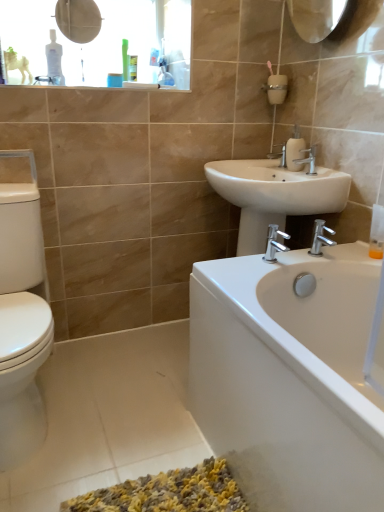
Consider the image. What is the approximate height of translucent plastic soap dispenser at right?

translucent plastic soap dispenser at right is 6.86 inches in height.

Locate an element on the screen. The height and width of the screenshot is (512, 384). matte plastic medicine cabinet at upper left is located at coordinates (96, 42).

Measure the distance between point (359, 488) and camera.

A distance of 28.58 inches exists between point (359, 488) and camera.

What is the approximate width of silver metallic faucet at lower right, the 2th tap viewed from the top?

silver metallic faucet at lower right, the 2th tap viewed from the top, is 4.57 inches wide.

Locate an element on the screen. The height and width of the screenshot is (512, 384). white glossy soap dispenser at upper right is located at coordinates (295, 150).

You are a GUI agent. You are given a task and a screenshot of the screen. Output one action in this format:
    pyautogui.click(x=<x>, y=<y>)
    Task: Click on the translucent plastic soap dispenser at right
    
    Given the screenshot: What is the action you would take?
    pyautogui.click(x=377, y=233)

How distant is white ceramic sink at center from translucent plastic soap dispenser at right?

The distance of white ceramic sink at center from translucent plastic soap dispenser at right is 14.11 inches.

Looking at their sizes, would you say white ceramic sink at center is wider or thinner than translucent plastic soap dispenser at right?

Considering their sizes, white ceramic sink at center looks broader than translucent plastic soap dispenser at right.

Is white ceramic sink at center next to translucent plastic soap dispenser at right?

No, white ceramic sink at center is not touching translucent plastic soap dispenser at right.

Is white ceramic sink at center completely or partially outside of translucent plastic soap dispenser at right?

white ceramic sink at center is positioned outside translucent plastic soap dispenser at right.

Does point (383, 240) lie in front of point (243, 236)?

Yes, it is.

Which of these two, translucent plastic soap dispenser at right or white ceramic sink at center, is thinner?

With smaller width is translucent plastic soap dispenser at right.

From the image's perspective, does translucent plastic soap dispenser at right appear lower than white ceramic sink at center?

Yes, from the image's perspective, translucent plastic soap dispenser at right is beneath white ceramic sink at center.

Is translucent plastic soap dispenser at right bigger or smaller than white ceramic sink at center?

Clearly, translucent plastic soap dispenser at right is smaller in size than white ceramic sink at center.

Is silver metallic faucet at upper center, the second tap when ordered from bottom to top, smaller than white glossy bathtub at lower right?

Indeed, silver metallic faucet at upper center, the second tap when ordered from bottom to top, has a smaller size compared to white glossy bathtub at lower right.

Relative to white glossy bathtub at lower right, is silver metallic faucet at upper center, marked as the 2th tap in a front-to-back arrangement, in front or behind?

Clearly, silver metallic faucet at upper center, marked as the 2th tap in a front-to-back arrangement, is behind white glossy bathtub at lower right.

From a real-world perspective, which is physically above, silver metallic faucet at upper center, the 1th tap from the back, or white glossy bathtub at lower right?

In real-world perspective, silver metallic faucet at upper center, the 1th tap from the back, is above.

Consider the image. Considering the sizes of silver metallic faucet at upper center, marked as the 2th tap in a front-to-back arrangement, and white glossy bathtub at lower right in the image, is silver metallic faucet at upper center, marked as the 2th tap in a front-to-back arrangement, taller or shorter than white glossy bathtub at lower right?

In the image, silver metallic faucet at upper center, marked as the 2th tap in a front-to-back arrangement, appears to be shorter than white glossy bathtub at lower right.

Does white glossy bathtub at lower right turn towards silver metallic faucet at upper center, marked as the 2th tap in a front-to-back arrangement?

No, white glossy bathtub at lower right does not turn towards silver metallic faucet at upper center, marked as the 2th tap in a front-to-back arrangement.

From a real-world perspective, is white glossy bathtub at lower right physically below silver metallic faucet at upper center, marked as the 2th tap in a front-to-back arrangement?

Correct, in the physical world, white glossy bathtub at lower right is lower than silver metallic faucet at upper center, marked as the 2th tap in a front-to-back arrangement.

Considering the sizes of objects white glossy bathtub at lower right and silver metallic faucet at upper center, marked as the 2th tap in a front-to-back arrangement, in the image provided, who is wider, white glossy bathtub at lower right or silver metallic faucet at upper center, marked as the 2th tap in a front-to-back arrangement,?

With larger width is white glossy bathtub at lower right.

Can you tell me how much white glossy bathtub at lower right and silver metallic faucet at upper center, the second tap when ordered from bottom to top, differ in facing direction?

The angle between the facing direction of white glossy bathtub at lower right and the facing direction of silver metallic faucet at upper center, the second tap when ordered from bottom to top, is 0.626 degrees.

Is silver metallic faucet at lower right, the first tap when ordered from front to back, turned away from white glossy bathtub at lower right?

No.

Considering the positions of objects silver metallic faucet at lower right, the first tap when ordered from front to back, and white glossy bathtub at lower right in the image provided, who is behind, silver metallic faucet at lower right, the first tap when ordered from front to back, or white glossy bathtub at lower right?

silver metallic faucet at lower right, the first tap when ordered from front to back, is more distant.

Is white glossy bathtub at lower right inside silver metallic faucet at lower right, the first tap when ordered from front to back?

No.

Is silver metallic faucet at lower right, the first tap when ordered from front to back, thinner than white glossy bathtub at lower right?

Yes.

Would you consider translucent plastic soap dispenser at right to be distant from white glossy bathtub at lower right?

Actually, translucent plastic soap dispenser at right and white glossy bathtub at lower right are a little close together.

Between translucent plastic soap dispenser at right and white glossy bathtub at lower right, which one has smaller width?

With smaller width is translucent plastic soap dispenser at right.

There is a white glossy bathtub at lower right. Where is `toiletry above it (from a real-world perspective)`? The image size is (384, 512). toiletry above it (from a real-world perspective) is located at coordinates (377, 233).

From the picture: Which object is closer to the camera, translucent plastic soap dispenser at right or white glossy bathtub at lower right?

Positioned in front is white glossy bathtub at lower right.

Based on their sizes in the image, would you say matte plastic medicine cabinet at upper left is bigger or smaller than white glossy bathtub at lower right?

Considering their sizes, matte plastic medicine cabinet at upper left takes up less space than white glossy bathtub at lower right.

What's the angular difference between matte plastic medicine cabinet at upper left and white glossy bathtub at lower right's facing directions?

matte plastic medicine cabinet at upper left and white glossy bathtub at lower right are facing 89.5 degrees away from each other.

Is matte plastic medicine cabinet at upper left behind white glossy bathtub at lower right?

Yes, it is.

Is point (49, 65) less distant than point (273, 438)?

No, it is behind (273, 438).

Locate an element on the screen. Image resolution: width=384 pixels, height=512 pixels. sink that is above the translucent plastic soap dispenser at right (from a real-world perspective) is located at coordinates (274, 195).

You are a GUI agent. You are given a task and a screenshot of the screen. Output one action in this format:
    pyautogui.click(x=<x>, y=<y>)
    Task: Click on the sink above the translucent plastic soap dispenser at right (from the image's perspective)
    
    Given the screenshot: What is the action you would take?
    pyautogui.click(x=274, y=195)

When comparing their distances from translucent plastic soap dispenser at right, does white glossy bathtub at lower right or white glossy soap dispenser at upper right seem further?

Among the two, white glossy bathtub at lower right is located further to translucent plastic soap dispenser at right.

From the image, which object appears to be farther from white ceramic sink at center, silver metallic faucet at lower right, the first tap when ordered from front to back, or silver metallic faucet at upper center, marked as the 2th tap in a front-to-back arrangement?

silver metallic faucet at lower right, the first tap when ordered from front to back, is further to white ceramic sink at center.

Estimate the real-world distances between objects in this image. Which object is closer to silver metallic faucet at lower right, the first tap when ordered from front to back, silver metallic faucet at upper center, the second tap when ordered from bottom to top, or white glossy bathtub at lower right?

The object closer to silver metallic faucet at lower right, the first tap when ordered from front to back, is silver metallic faucet at upper center, the second tap when ordered from bottom to top.

Considering their positions, is white ceramic sink at center positioned further to silver metallic faucet at lower right, the first tap when ordered from front to back, than white glossy bathtub at lower right?

white glossy bathtub at lower right lies further to silver metallic faucet at lower right, the first tap when ordered from front to back, than the other object.

Based on the photo, considering their positions, is matte plastic medicine cabinet at upper left positioned closer to white glossy bathtub at lower right than silver metallic faucet at lower right, the 2th tap viewed from the top?

silver metallic faucet at lower right, the 2th tap viewed from the top, is positioned closer to the anchor white glossy bathtub at lower right.

When comparing their distances from translucent plastic soap dispenser at right, does matte plastic medicine cabinet at upper left or silver metallic faucet at lower right, the 1th tap from the bottom, seem further?

Based on the image, matte plastic medicine cabinet at upper left appears to be further to translucent plastic soap dispenser at right.

Which object lies further to the anchor point silver metallic faucet at upper center, the 1th tap from the back, white glossy bathtub at lower right or white glossy soap dispenser at upper right?

Based on the image, white glossy bathtub at lower right appears to be further to silver metallic faucet at upper center, the 1th tap from the back.

Which object lies nearer to the anchor point white ceramic sink at center, silver metallic faucet at upper center, marked as the 2th tap in a front-to-back arrangement, or translucent plastic soap dispenser at right?

silver metallic faucet at upper center, marked as the 2th tap in a front-to-back arrangement, is closer to white ceramic sink at center.

Find the location of a particular element. This screenshot has width=384, height=512. tap between white glossy bathtub at lower right and silver metallic faucet at upper center, which is the 1th tap in top-to-bottom order, in the front-back direction is located at coordinates (320, 237).

Where is `tap between white glossy soap dispenser at upper right and silver metallic faucet at lower right, marked as the second tap in a back-to-front arrangement, vertically`? The width and height of the screenshot is (384, 512). tap between white glossy soap dispenser at upper right and silver metallic faucet at lower right, marked as the second tap in a back-to-front arrangement, vertically is located at coordinates (308, 159).

This screenshot has height=512, width=384. Find the location of `sink between matte plastic medicine cabinet at upper left and silver metallic faucet at lower right, the 1th tap from the bottom, in the up-down direction`. sink between matte plastic medicine cabinet at upper left and silver metallic faucet at lower right, the 1th tap from the bottom, in the up-down direction is located at coordinates (274, 195).

What are the coordinates of `toiletry between white glossy soap dispenser at upper right and silver metallic faucet at lower right, the 1th tap from the bottom, in the up-down direction` in the screenshot? It's located at (377, 233).